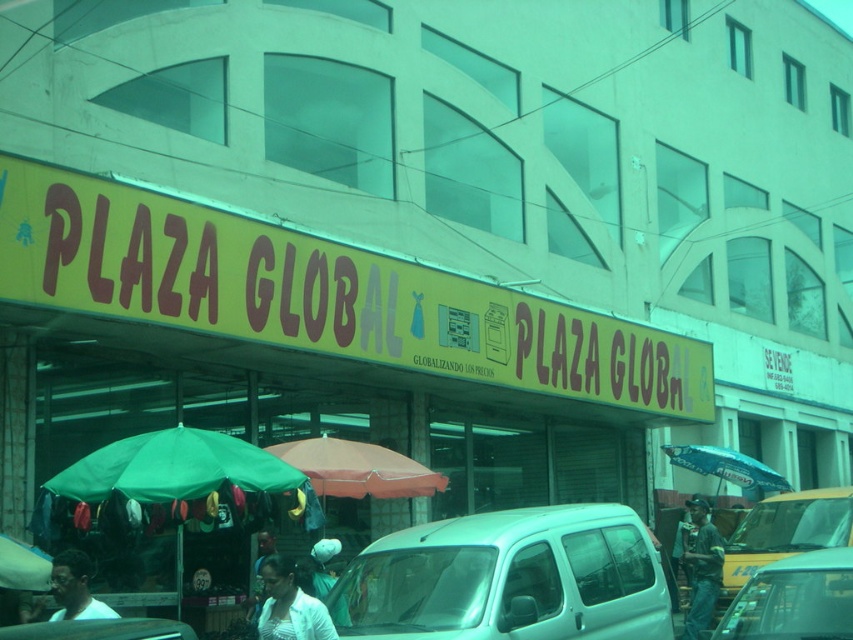
In the scene shown: Is white matte van at center taller than white fabric shirt at lower center?

Yes, white matte van at center is taller than white fabric shirt at lower center.

Who is positioned more to the right, white matte van at center or white fabric shirt at lower center?

Positioned to the right is white matte van at center.

Who is more distant from viewer, (485, 520) or (276, 580)?

The point (485, 520) is behind.

This screenshot has height=640, width=853. I want to click on white matte van at center, so click(508, 579).

You are a GUI agent. You are given a task and a screenshot of the screen. Output one action in this format:
    pyautogui.click(x=<x>, y=<y>)
    Task: Click on the white fabric shirt at lower center
    The height and width of the screenshot is (640, 853).
    Given the screenshot: What is the action you would take?
    pyautogui.click(x=289, y=605)

From the picture: Is white fabric shirt at lower center shorter than metallic silver car at lower center?

No, white fabric shirt at lower center is not shorter than metallic silver car at lower center.

Is point (296, 634) positioned in front of point (178, 636)?

No, it is behind (178, 636).

Find the location of a particular element. white fabric shirt at lower center is located at coordinates coord(289,605).

Does metallic silver car at lower right appear on the left side of white fabric shirt at lower center?

No, metallic silver car at lower right is not to the left of white fabric shirt at lower center.

Between metallic silver car at lower right and white fabric shirt at lower center, which one is positioned lower?

white fabric shirt at lower center is lower down.

Is point (828, 630) in front of point (276, 600)?

Yes, point (828, 630) is closer to viewer.

Find the location of a particular element. This screenshot has height=640, width=853. metallic silver car at lower right is located at coordinates (793, 600).